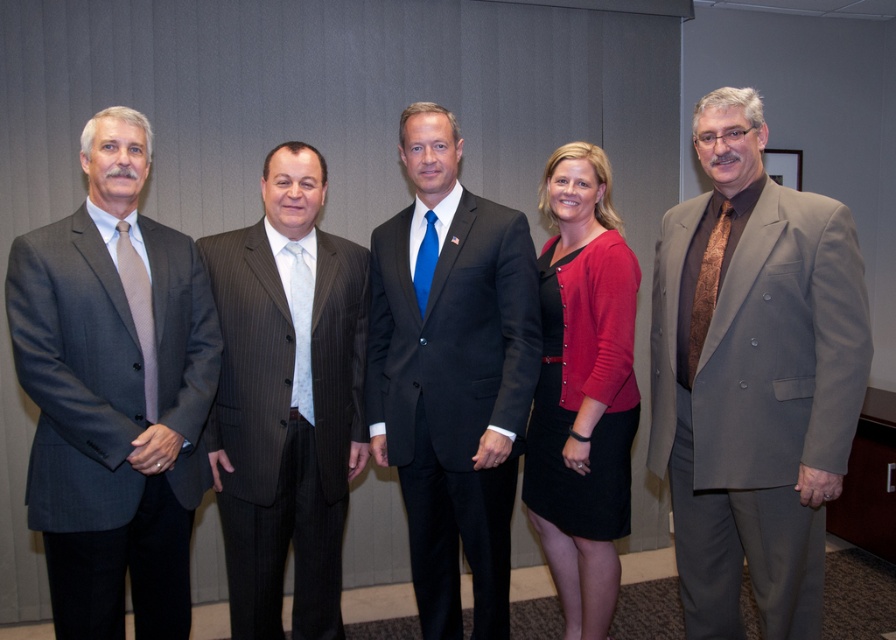
You are a photographer setting up for a group photo. You notice the matte gray suit at right and the pinstriped suit at center. Which person should you position closer to the camera to ensure both are in focus?

You should position the matte gray suit at right closer to the camera because it is shorter than the pinstriped suit at center, ensuring both are in focus.